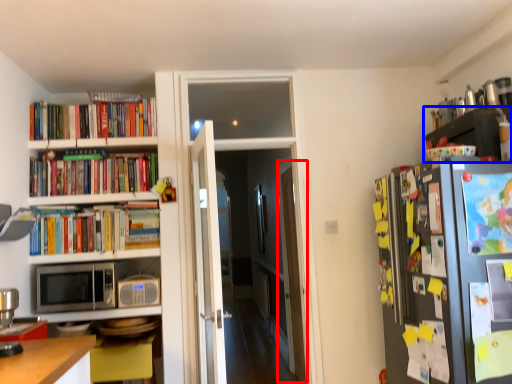
Question: Which object is further to the camera taking this photo, glass door (highlighted by a red box) or shelf (highlighted by a blue box)?

Choices:
 (A) glass door
 (B) shelf

Answer: (A)